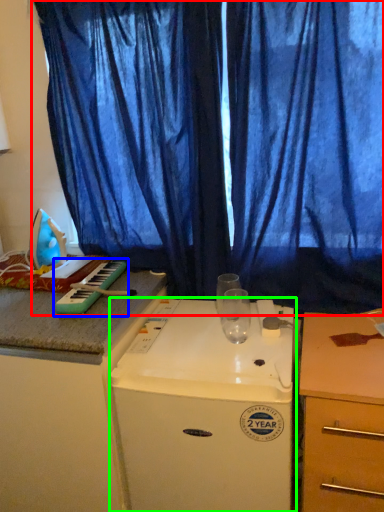
Question: Which object is the farthest from curtain (highlighted by a red box)? Choose among these: musical keyboard (highlighted by a blue box) or home appliance (highlighted by a green box).

Choices:
 (A) musical keyboard
 (B) home appliance

Answer: (A)